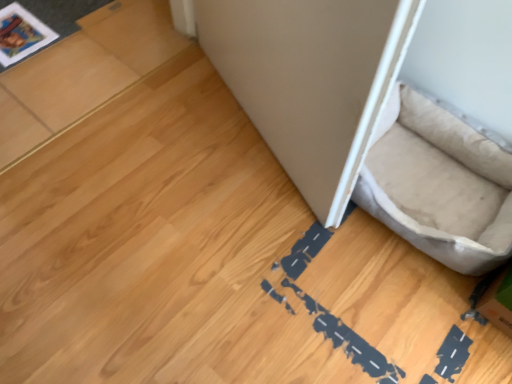
Where is `free region on the left part of beige fabric dog bed at lower right`? free region on the left part of beige fabric dog bed at lower right is located at coordinates (260, 216).